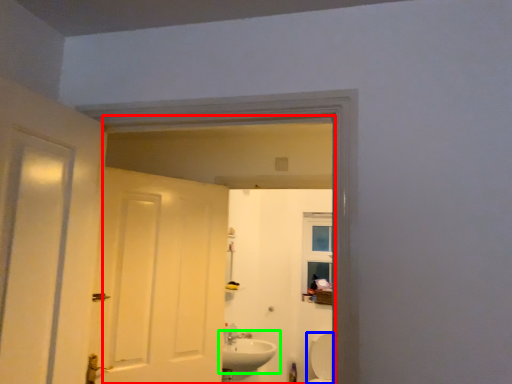
Question: Which is nearer to the mirror (highlighted by a red box)? bath (highlighted by a blue box) or sink (highlighted by a green box).

Choices:
 (A) bath
 (B) sink

Answer: (A)